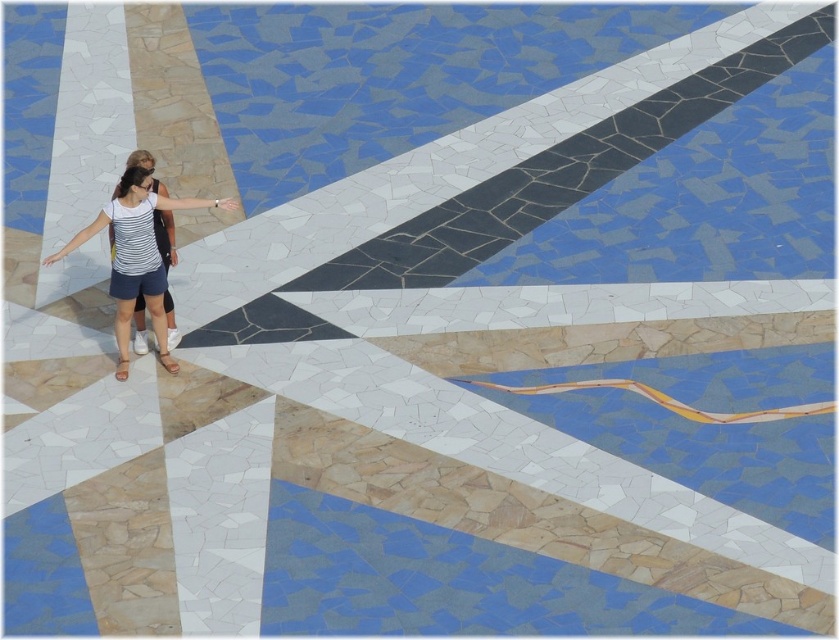
Question: Based on their relative distances, which object is nearer to the striped fabric top at center?

Choices:
 (A) brown leather sandal at lower center
 (B) striped fabric girl at center
 (C) light brown leather sandal at lower left

Answer: (B)

Question: Can you confirm if striped fabric girl at center is positioned to the right of striped fabric top at center?

Choices:
 (A) yes
 (B) no

Answer: (B)

Question: Estimate the real-world distances between objects in this image. Which object is farther from the striped fabric top at center?

Choices:
 (A) brown leather sandal at lower center
 (B) striped fabric girl at center
 (C) light brown leather sandal at lower left

Answer: (C)

Question: Estimate the real-world distances between objects in this image. Which object is closer to the brown leather sandal at lower center?

Choices:
 (A) light brown leather sandal at lower left
 (B) striped fabric top at center
 (C) striped fabric girl at center

Answer: (A)

Question: Is striped fabric top at center closer to the viewer compared to brown leather sandal at lower center?

Choices:
 (A) no
 (B) yes

Answer: (B)

Question: Can you confirm if brown leather sandal at lower center is positioned to the right of light brown leather sandal at lower left?

Choices:
 (A) yes
 (B) no

Answer: (A)